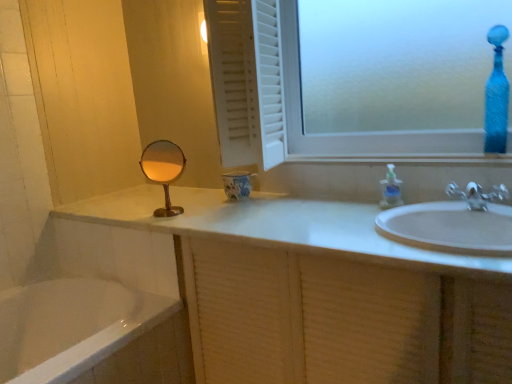
Locate an element on the screen. vacant space behind silver metallic faucet at right is located at coordinates (448, 199).